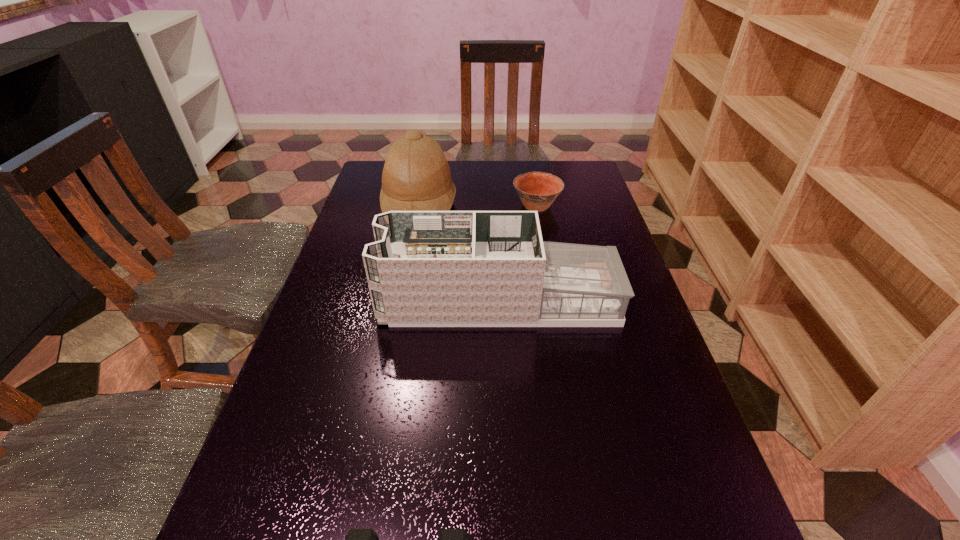
Identify which object is the second nearest to the tallest object. Please provide its 2D coordinates. Your answer should be formatted as a tuple, i.e. [(x, y)], where the tuple contains the x and y coordinates of a point satisfying the conditions above.

[(426, 268)]

Identify which object is the second nearest to the tallest object. Please provide its 2D coordinates. Your answer should be formatted as a tuple, i.e. [(x, y)], where the tuple contains the x and y coordinates of a point satisfying the conditions above.

[(426, 268)]

You are a GUI agent. You are given a task and a screenshot of the screen. Output one action in this format:
    pyautogui.click(x=<x>, y=<y>)
    Task: Click on the vacant space that satisfies the following two spatial constraints: 1. on the front-facing side of the hat; 2. on the back side of the bowl
    This screenshot has width=960, height=540.
    Given the screenshot: What is the action you would take?
    pyautogui.click(x=420, y=206)

Identify the location of vacant area that satisfies the following two spatial constraints: 1. on the front side of the third tallest object; 2. at the entrance of the dollhouse. This screenshot has height=540, width=960. (553, 300).